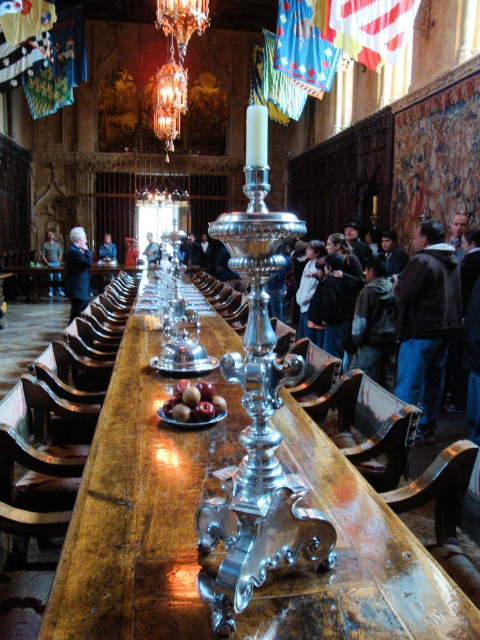
Does point (75, 248) come behind point (55, 272)?

No, it is not.

Which is in front, point (74, 278) or point (60, 250)?

Point (74, 278) is in front.

Locate an element on the screen. This screenshot has height=640, width=480. dark brown leather jacket at center is located at coordinates (78, 269).

Is dark brown leather jacket at center behind orange fabric jacket at center?

No, it is in front of orange fabric jacket at center.

Does dark brown leather jacket at center appear on the left side of orange fabric jacket at center?

In fact, dark brown leather jacket at center is to the right of orange fabric jacket at center.

Does point (80, 252) lie behind point (126, 253)?

No, it is not.

This screenshot has width=480, height=640. I want to click on dark brown leather jacket at center, so click(78, 269).

Who is more forward, (x=408, y=392) or (x=91, y=252)?

Point (x=408, y=392) is more forward.

Between brown leather jacket at right and dark brown leather jacket at center, which one has more height?

Standing taller between the two is brown leather jacket at right.

At what (x,y) coordinates should I click in order to perform the action: click on brown leather jacket at right. Please return your answer as a coordinate pair (x, y). The image size is (480, 640). Looking at the image, I should click on (425, 323).